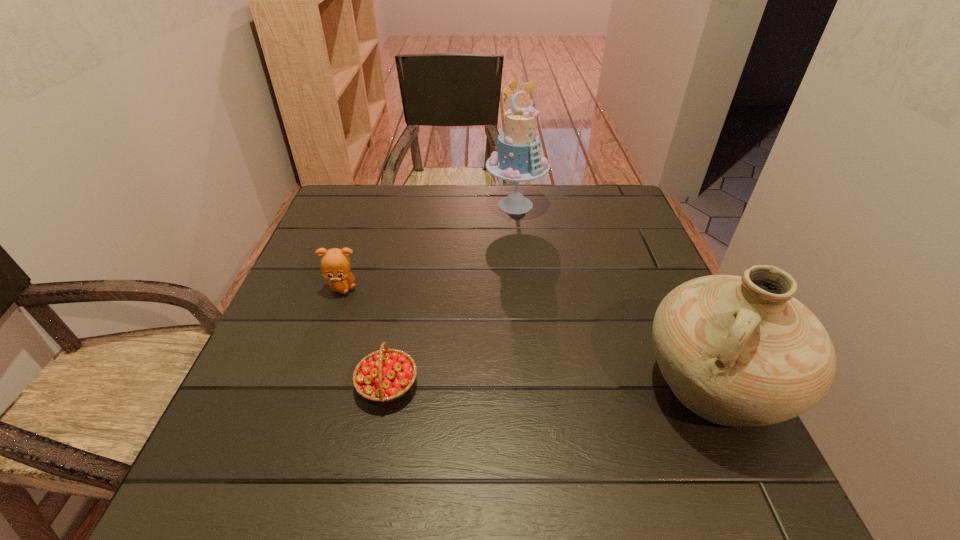
Identify the location of free location located with a ladder on the side of the third object from left to right. (542, 276).

Find the location of a particular element. The height and width of the screenshot is (540, 960). blank area located with a ladder on the side of the third object from left to right is located at coordinates (554, 307).

Where is `vacant space situated 0.340m with a ladder on the side of the third object from left to right`? vacant space situated 0.340m with a ladder on the side of the third object from left to right is located at coordinates (553, 305).

Identify the location of vacant space located 0.360m on the face of the third nearest object. (482, 364).

This screenshot has width=960, height=540. In order to click on free space located 0.320m on the face of the third nearest object in this screenshot , I will do `click(466, 355)`.

Find the location of a particular element. This screenshot has height=540, width=960. vacant space located on the face of the third nearest object is located at coordinates (399, 318).

I want to click on object that is positioned at the far edge, so [518, 159].

The width and height of the screenshot is (960, 540). In order to click on strawberry at the near edge in this screenshot , I will do `click(385, 375)`.

This screenshot has height=540, width=960. Find the location of `pottery situated at the near edge`. pottery situated at the near edge is located at coordinates (736, 350).

In order to click on object that is at the left edge in this screenshot , I will do `click(335, 264)`.